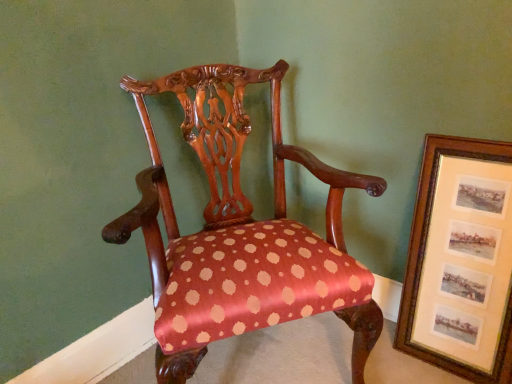
Question: Relative to wooden framed prints at right, is polished wood chair at center in front or behind?

Choices:
 (A) behind
 (B) front

Answer: (B)

Question: From their relative heights in the image, would you say polished wood chair at center is taller or shorter than wooden framed prints at right?

Choices:
 (A) short
 (B) tall

Answer: (B)

Question: From the image's perspective, is polished wood chair at center located above or below wooden framed prints at right?

Choices:
 (A) above
 (B) below

Answer: (A)

Question: Is point (510, 345) positioned closer to the camera than point (151, 137)?

Choices:
 (A) farther
 (B) closer

Answer: (B)

Question: From the image's perspective, is wooden framed prints at right above or below polished wood chair at center?

Choices:
 (A) above
 (B) below

Answer: (B)

Question: From their relative heights in the image, would you say wooden framed prints at right is taller or shorter than polished wood chair at center?

Choices:
 (A) short
 (B) tall

Answer: (A)

Question: Considering the relative positions of wooden framed prints at right and polished wood chair at center in the image provided, is wooden framed prints at right to the left or to the right of polished wood chair at center?

Choices:
 (A) right
 (B) left

Answer: (A)